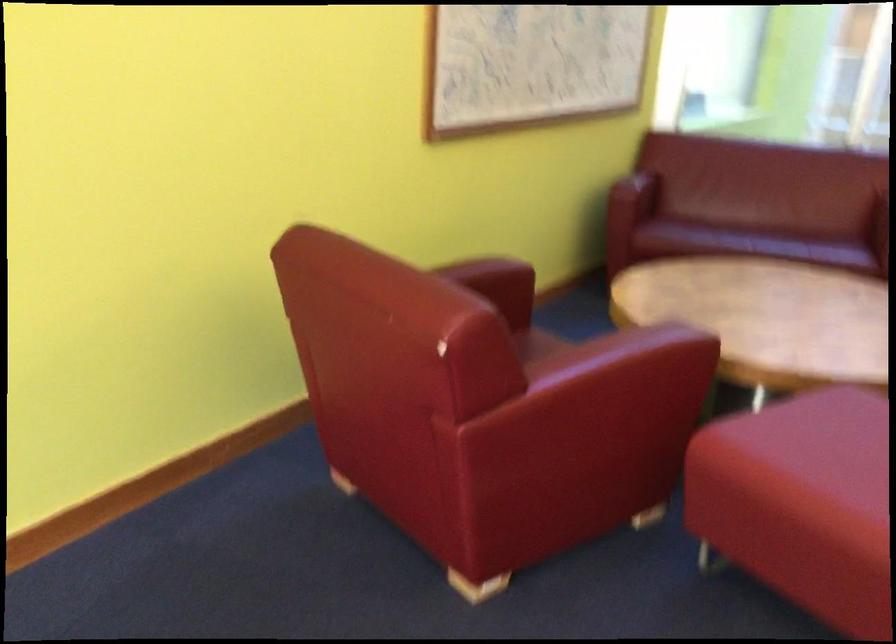
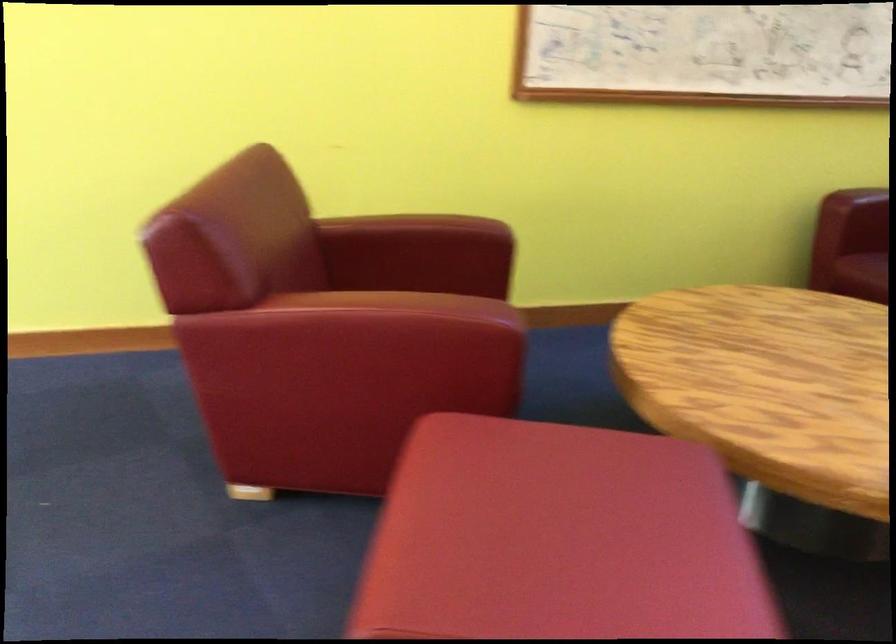
The point at (464, 281) is marked in the first image. Where is the corresponding point in the second image?

(411, 232)